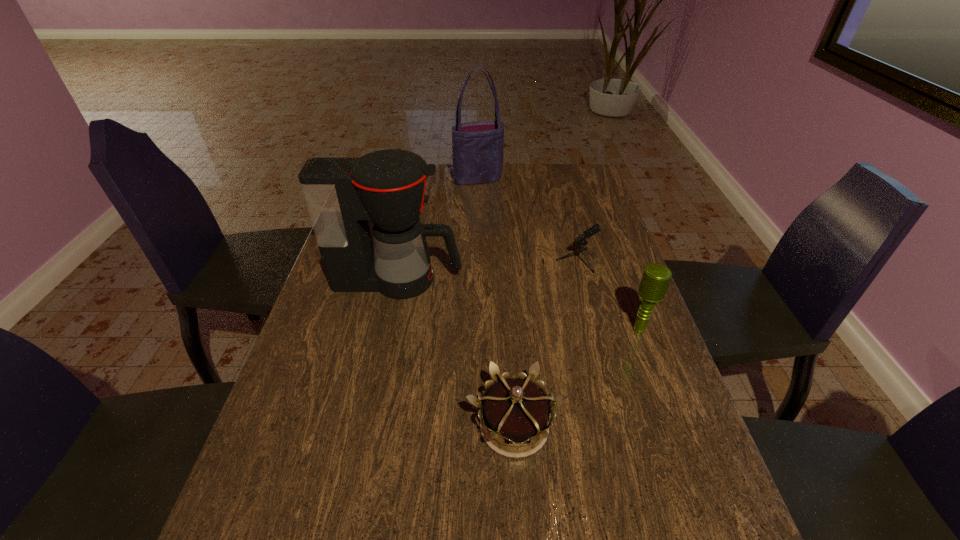
Where is `vacant point located between the coffee maker and the nearest object`? This screenshot has height=540, width=960. vacant point located between the coffee maker and the nearest object is located at coordinates (456, 353).

Locate an element on the screen. The image size is (960, 540). vacant area between the crown and the coffee maker is located at coordinates (456, 353).

You are a GUI agent. You are given a task and a screenshot of the screen. Output one action in this format:
    pyautogui.click(x=<x>, y=<y>)
    Task: Click on the vacant region between the farther microphone and the nearest object
    
    Given the screenshot: What is the action you would take?
    pyautogui.click(x=537, y=343)

Locate an element on the screen. The height and width of the screenshot is (540, 960). vacant region between the crown and the farthest object is located at coordinates (496, 303).

Image resolution: width=960 pixels, height=540 pixels. What are the coordinates of `vacant point located between the coffee maker and the third tallest object` in the screenshot? It's located at (519, 305).

Find the location of a particular element. free spot between the farthest object and the rightmost object is located at coordinates (559, 254).

This screenshot has height=540, width=960. In order to click on vacant area between the farther microphone and the coffee maker in this screenshot , I will do `click(478, 270)`.

Where is `free space that is in between the coffee maker and the nearest object`? free space that is in between the coffee maker and the nearest object is located at coordinates (456, 353).

Where is `vacant space that is in between the third shortest object and the tote bag`? Image resolution: width=960 pixels, height=540 pixels. vacant space that is in between the third shortest object and the tote bag is located at coordinates (559, 254).

Locate an element on the screen. object that is the fourth closest to the coffee maker is located at coordinates (477, 147).